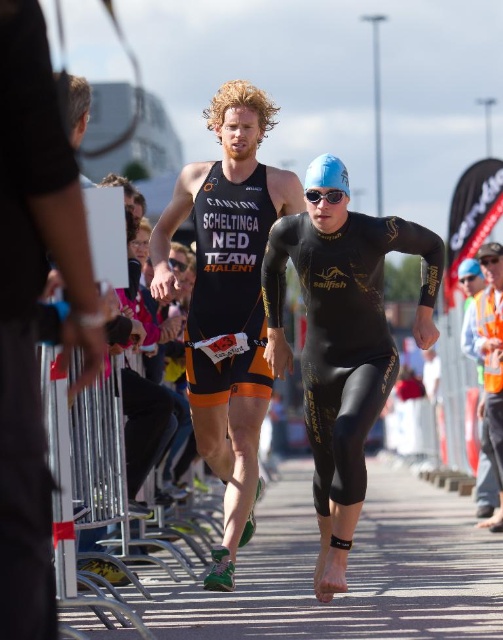
You are a photographer at the triathlon event. You want to capture a photo of the matte black triathlon suit at center and orange reflective vest at right. Based on their positions, which object should you focus on first to ensure both are in the frame?

The matte black triathlon suit at center is to the left of the orange reflective vest at right. Therefore, you should focus on the matte black triathlon suit at center first as it is closer to the left edge of the frame to include both in the photo.

You are a photographer positioned at the origin of the coordinate system. You want to capture both athletes in a single shot. Given that the first athlete is located at point (233, 204) and the second athlete is at point (316, 202), which athlete is positioned further back from your camera lens?

Point (233, 204) is behind point (316, 202), so the athlete at point (233, 204) is further back from the camera lens.